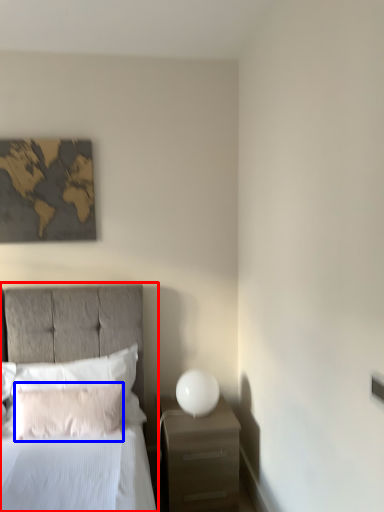
Question: Which object is closer to the camera taking this photo, bed (highlighted by a red box) or pillow (highlighted by a blue box)?

Choices:
 (A) bed
 (B) pillow

Answer: (A)